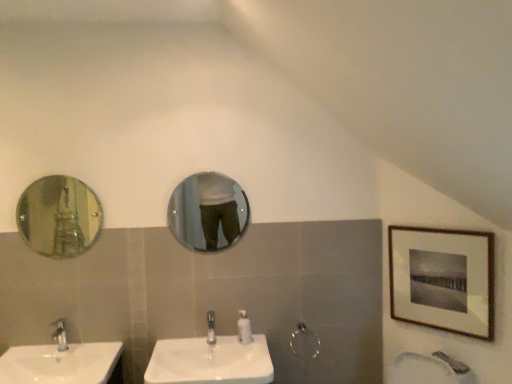
Locate an element on the screen. Image resolution: width=512 pixels, height=384 pixels. silver metallic faucet at lower left, the first tap viewed from the left is located at coordinates (60, 334).

The height and width of the screenshot is (384, 512). Find the location of `wooden-framed print at upper right`. wooden-framed print at upper right is located at coordinates (443, 279).

Identify the location of white glossy sink at lower left, acting as the second sink starting from the right. The height and width of the screenshot is (384, 512). (63, 362).

Where is `silver metallic faucet at lower left, the 2th tap when ordered from right to left`? silver metallic faucet at lower left, the 2th tap when ordered from right to left is located at coordinates (60, 334).

How many degrees apart are the facing directions of white glossy sink at center, which is the first sink from right to left, and silver metallic faucet at lower left, the 2th tap when ordered from right to left?

The angular difference between white glossy sink at center, which is the first sink from right to left, and silver metallic faucet at lower left, the 2th tap when ordered from right to left, is 0.339 degrees.

Could you tell me if white glossy sink at center, the second sink positioned from the left, is turned towards silver metallic faucet at lower left, the 2th tap when ordered from right to left?

No.

Is the depth of white glossy sink at center, the second sink positioned from the left, less than that of silver metallic faucet at lower left, the 2th tap when ordered from right to left?

Yes, it is.

Is point (458, 265) more distant than point (212, 320)?

No, (458, 265) is in front of (212, 320).

Can you confirm if wooden-framed print at upper right is positioned to the right of satin chrome faucet at center, which is the 2th tap from left to right?

Yes.

Can you confirm if wooden-framed print at upper right is taller than satin chrome faucet at center, which is the 2th tap from left to right?

Yes, wooden-framed print at upper right is taller than satin chrome faucet at center, which is the 2th tap from left to right.

Can you confirm if wooden-framed print at upper right is smaller than satin chrome faucet at center, marked as the first tap in a right-to-left arrangement?

No.

From the picture: Is wooden-framed print at upper right located within satin chrome faucet at center, marked as the first tap in a right-to-left arrangement?

No, wooden-framed print at upper right is not a part of satin chrome faucet at center, marked as the first tap in a right-to-left arrangement.

Could you tell me if satin chrome faucet at center, which is the 2th tap from left to right, is turned towards wooden-framed print at upper right?

No, satin chrome faucet at center, which is the 2th tap from left to right, is not facing towards wooden-framed print at upper right.

Is point (212, 323) closer or farther from the camera than point (423, 259)?

Point (212, 323) is farther from the camera than point (423, 259).

Is silver metallic shower at center a part of matte glass mirror at center, marked as the 2th mirror in a left-to-right arrangement?

No, silver metallic shower at center is not surrounded by matte glass mirror at center, marked as the 2th mirror in a left-to-right arrangement.

From the image's perspective, between matte glass mirror at center, positioned as the 1th mirror in right-to-left order, and silver metallic shower at center, which one is located above?

matte glass mirror at center, positioned as the 1th mirror in right-to-left order.

Who is taller, matte glass mirror at center, marked as the 2th mirror in a left-to-right arrangement, or silver metallic shower at center?

Standing taller between the two is matte glass mirror at center, marked as the 2th mirror in a left-to-right arrangement.

You are a GUI agent. You are given a task and a screenshot of the screen. Output one action in this format:
    pyautogui.click(x=<x>, y=<y>)
    Task: Click on the shower that appears below the matte glass mirror at center, arranged as the first mirror when viewed from the back (from the image's perspective)
    The width and height of the screenshot is (512, 384).
    Given the screenshot: What is the action you would take?
    pyautogui.click(x=304, y=342)

Is wooden-framed print at upper right at the back of white glossy sink at center, the second sink positioned from the left?

white glossy sink at center, the second sink positioned from the left, is not turned away from wooden-framed print at upper right.

Which of these two, white glossy sink at center, the second sink positioned from the left, or wooden-framed print at upper right, stands taller?

A: With more height is wooden-framed print at upper right.

Measure the distance between white glossy sink at center, which is the first sink from right to left, and wooden-framed print at upper right.

white glossy sink at center, which is the first sink from right to left, and wooden-framed print at upper right are 3.31 feet apart.

Between white glossy sink at center, the second sink positioned from the left, and wooden-framed print at upper right, which one has larger size?

With larger size is white glossy sink at center, the second sink positioned from the left.

Relative to satin chrome faucet at center, which is the 2th tap from left to right, is silver metallic shower at center in front or behind?

In the image, silver metallic shower at center appears behind satin chrome faucet at center, which is the 2th tap from left to right.

How many degrees apart are the facing directions of silver metallic shower at center and satin chrome faucet at center, marked as the first tap in a right-to-left arrangement?

0.0044 degrees.

From the image's perspective, who appears lower, silver metallic shower at center or satin chrome faucet at center, marked as the first tap in a right-to-left arrangement?

silver metallic shower at center, from the image's perspective.

From a real-world perspective, is silver metallic shower at center located beneath satin chrome faucet at center, marked as the first tap in a right-to-left arrangement?

Yes, from a real-world perspective, silver metallic shower at center is under satin chrome faucet at center, marked as the first tap in a right-to-left arrangement.

From the image's perspective, count 1st mirrors upward from the silver metallic faucet at lower left, the 2th tap when ordered from right to left, and point to it. Please provide its 2D coordinates.

[(59, 217)]

How many degrees apart are the facing directions of silver metallic faucet at lower left, the 2th tap when ordered from right to left, and shiny silver mirror at left, arranged as the first mirror when viewed from the left?

The facing directions of silver metallic faucet at lower left, the 2th tap when ordered from right to left, and shiny silver mirror at left, arranged as the first mirror when viewed from the left, are 0.0425 degrees apart.

Is silver metallic faucet at lower left, the first tap viewed from the left, to the left of shiny silver mirror at left, the 1th mirror viewed from the front, from the viewer's perspective?

No.

From the image's perspective, would you say silver metallic faucet at lower left, the 2th tap when ordered from right to left, is shown under shiny silver mirror at left, arranged as the first mirror when viewed from the left?

Indeed, from the image's perspective, silver metallic faucet at lower left, the 2th tap when ordered from right to left, is shown beneath shiny silver mirror at left, arranged as the first mirror when viewed from the left.

From the image's perspective, count 1st sinks downward from the silver metallic faucet at lower left, the first tap viewed from the left, and point to it. Please provide its 2D coordinates.

[(212, 359)]

Where is `the 1st tap to the left of the wooden-framed print at upper right, counting from the anchor's position`? The width and height of the screenshot is (512, 384). the 1st tap to the left of the wooden-framed print at upper right, counting from the anchor's position is located at coordinates (211, 328).

Which object lies further to the anchor point white glossy sink at center, the second sink positioned from the left, wooden-framed print at upper right or silver metallic shower at center?

Based on the image, wooden-framed print at upper right appears to be further to white glossy sink at center, the second sink positioned from the left.

Considering their positions, is white glossy sink at center, which is the first sink from right to left, positioned closer to white glossy soap dispenser at center than satin chrome faucet at center, which is the 2th tap from left to right?

satin chrome faucet at center, which is the 2th tap from left to right.

When comparing their distances from silver metallic faucet at lower left, the first tap viewed from the left, does white glossy sink at lower left, acting as the second sink starting from the right, or shiny silver mirror at left, the 2th mirror viewed from the right, seem closer?

white glossy sink at lower left, acting as the second sink starting from the right, is closer to silver metallic faucet at lower left, the first tap viewed from the left.

Considering their positions, is shiny silver mirror at left, the 1th mirror viewed from the front, positioned further to wooden-framed print at upper right than satin chrome faucet at center, which is the 2th tap from left to right?

Based on the image, shiny silver mirror at left, the 1th mirror viewed from the front, appears to be further to wooden-framed print at upper right.

From the image, which object appears to be farther from white glossy sink at center, the second sink positioned from the left, white glossy sink at lower left, acting as the second sink starting from the right, or matte glass mirror at center, arranged as the first mirror when viewed from the back?

The object further to white glossy sink at center, the second sink positioned from the left, is matte glass mirror at center, arranged as the first mirror when viewed from the back.

From the image, which object appears to be farther from satin chrome faucet at center, marked as the first tap in a right-to-left arrangement, silver metallic faucet at lower left, the first tap viewed from the left, or white glossy soap dispenser at center?

Result: Among the two, silver metallic faucet at lower left, the first tap viewed from the left, is located further to satin chrome faucet at center, marked as the first tap in a right-to-left arrangement.

Looking at the image, which one is located closer to silver metallic shower at center, white glossy soap dispenser at center or satin chrome faucet at center, marked as the first tap in a right-to-left arrangement?

The object closer to silver metallic shower at center is white glossy soap dispenser at center.

When comparing their distances from satin chrome faucet at center, which is the 2th tap from left to right, does wooden-framed print at upper right or matte glass mirror at center, arranged as the first mirror when viewed from the back, seem closer?

The object closer to satin chrome faucet at center, which is the 2th tap from left to right, is matte glass mirror at center, arranged as the first mirror when viewed from the back.

Image resolution: width=512 pixels, height=384 pixels. I want to click on soap dispenser situated between shiny silver mirror at left, the 2th mirror viewed from the right, and silver metallic shower at center from left to right, so click(x=244, y=328).

At what (x,y) coordinates should I click in order to perform the action: click on mirror located between silver metallic faucet at lower left, the 2th tap when ordered from right to left, and satin chrome faucet at center, marked as the first tap in a right-to-left arrangement, in the left-right direction. Please return your answer as a coordinate pair (x, y). Looking at the image, I should click on (208, 212).

Find the location of `sink located between white glossy sink at lower left, acting as the second sink starting from the right, and wooden-framed print at upper right in the left-right direction`. sink located between white glossy sink at lower left, acting as the second sink starting from the right, and wooden-framed print at upper right in the left-right direction is located at coordinates (212, 359).

Find the location of a particular element. tap located between white glossy sink at lower left, which ranks as the first sink in left-to-right order, and silver metallic shower at center in the left-right direction is located at coordinates (211, 328).